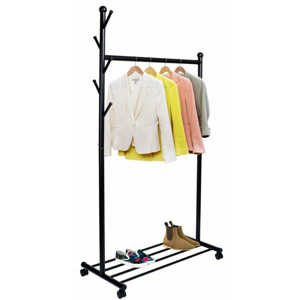
The width and height of the screenshot is (300, 300). I want to click on metal hangers, so click(x=108, y=105), click(x=94, y=81), click(x=105, y=66), click(x=96, y=37), click(x=105, y=17).